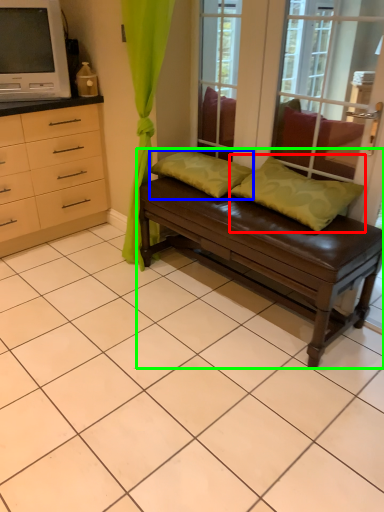
Question: Based on their relative distances, which object is nearer to pillow (highlighted by a red box)? Choose from pillow (highlighted by a blue box) and studio couch (highlighted by a green box).

Choices:
 (A) pillow
 (B) studio couch

Answer: (B)